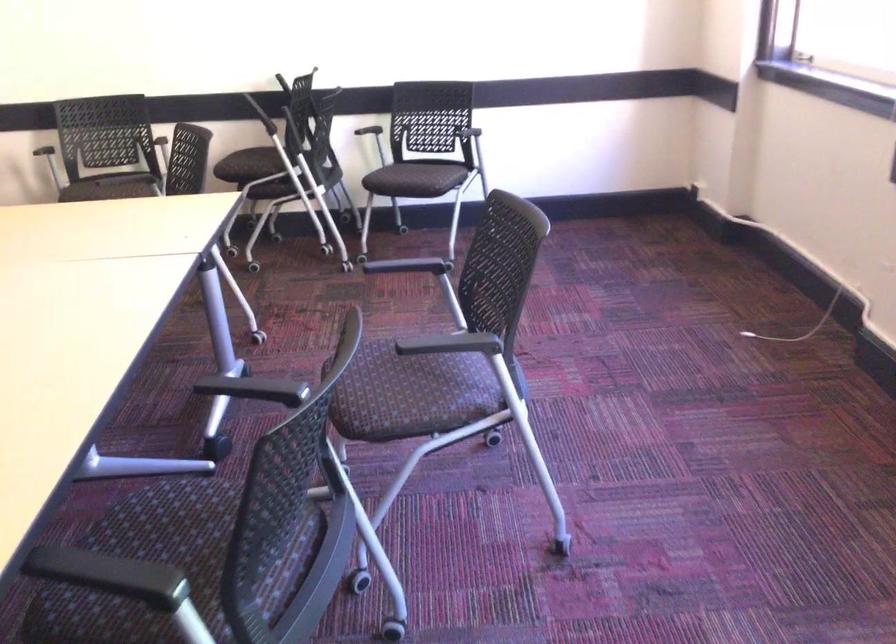
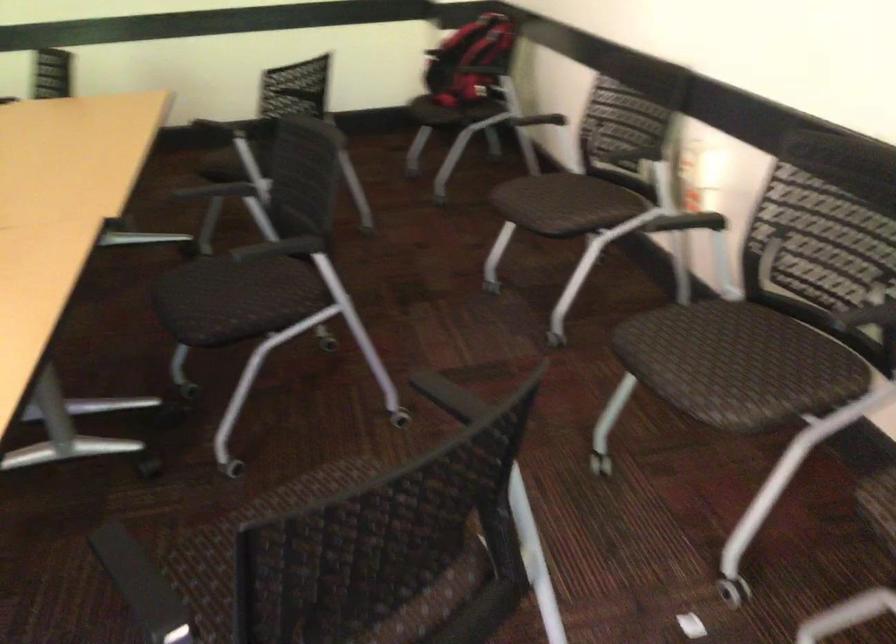
Question: I am providing you with two images of the same scene from different viewpoints. Which of the following objects are not visible in image2?

Choices:
 (A) black chair armrest
 (B) cardboard Amazon box
 (C) chair armrest
 (D) red backpack

Answer: (A)